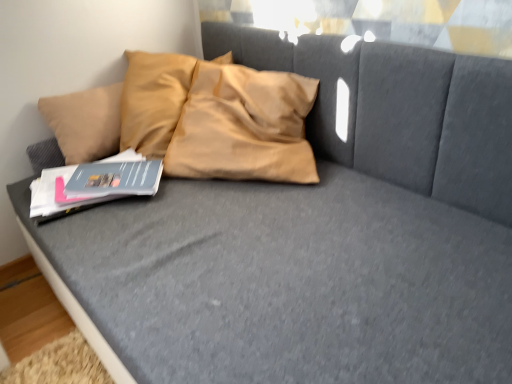
Question: Can you confirm if matte blue paperback book at left, the first paperback book positioned from the front, is shorter than matte blue paperback book at center-left, the second paperback book in the front-to-back sequence?

Choices:
 (A) no
 (B) yes

Answer: (A)

Question: Is matte blue paperback book at left, the first paperback book positioned from the front, to the right of matte blue paperback book at center-left, marked as the 1th paperback book in a back-to-front arrangement, from the viewer's perspective?

Choices:
 (A) yes
 (B) no

Answer: (B)

Question: Is matte blue paperback book at left, the first paperback book positioned from the front, in front of matte blue paperback book at center-left, the second paperback book in the front-to-back sequence?

Choices:
 (A) yes
 (B) no

Answer: (A)

Question: Would you say matte blue paperback book at left, the first paperback book positioned from the front, is a long distance from matte blue paperback book at center-left, marked as the 1th paperback book in a back-to-front arrangement?

Choices:
 (A) no
 (B) yes

Answer: (A)

Question: Can you confirm if matte blue paperback book at left, arranged as the 2th paperback book when viewed from the back, is bigger than matte blue paperback book at center-left, marked as the 1th paperback book in a back-to-front arrangement?

Choices:
 (A) yes
 (B) no

Answer: (A)

Question: Is matte blue paperback book at left, the first paperback book positioned from the front, positioned with its back to matte blue paperback book at center-left, marked as the 1th paperback book in a back-to-front arrangement?

Choices:
 (A) no
 (B) yes

Answer: (A)

Question: Would you say matte blue paperback book at center-left, the second paperback book in the front-to-back sequence, is outside matte blue paperback book at left, the first paperback book positioned from the front?

Choices:
 (A) yes
 (B) no

Answer: (B)

Question: Is matte blue paperback book at center-left, marked as the 1th paperback book in a back-to-front arrangement, in front of matte blue paperback book at left, the first paperback book positioned from the front?

Choices:
 (A) no
 (B) yes

Answer: (A)

Question: From the image's perspective, is matte blue paperback book at center-left, the second paperback book in the front-to-back sequence, below matte blue paperback book at left, the first paperback book positioned from the front?

Choices:
 (A) yes
 (B) no

Answer: (B)

Question: Could you tell me if matte blue paperback book at center-left, the second paperback book in the front-to-back sequence, is turned towards matte blue paperback book at left, arranged as the 2th paperback book when viewed from the back?

Choices:
 (A) no
 (B) yes

Answer: (A)

Question: Considering the relative sizes of matte blue paperback book at center-left, marked as the 1th paperback book in a back-to-front arrangement, and matte blue paperback book at left, arranged as the 2th paperback book when viewed from the back, in the image provided, is matte blue paperback book at center-left, marked as the 1th paperback book in a back-to-front arrangement, shorter than matte blue paperback book at left, arranged as the 2th paperback book when viewed from the back,?

Choices:
 (A) yes
 (B) no

Answer: (A)

Question: Is matte blue paperback book at center-left, the second paperback book in the front-to-back sequence, bigger than matte blue paperback book at left, arranged as the 2th paperback book when viewed from the back?

Choices:
 (A) no
 (B) yes

Answer: (A)

Question: From a real-world perspective, is matte blue paperback book at left, arranged as the 2th paperback book when viewed from the back, positioned above or below matte blue paperback book at center-left, the second paperback book in the front-to-back sequence?

Choices:
 (A) above
 (B) below

Answer: (B)